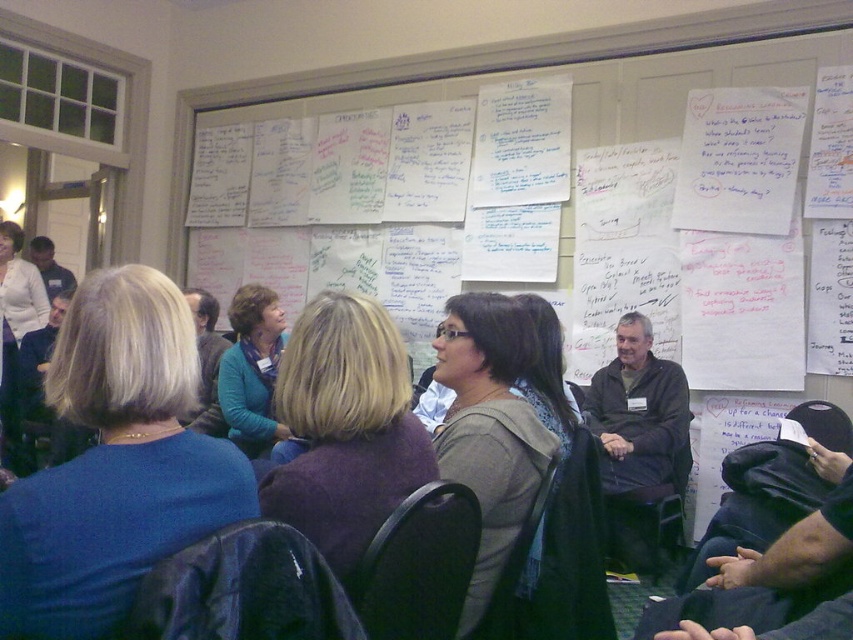
Question: Can you confirm if dark purple sweater at center is positioned above gray sweater at center?

Choices:
 (A) yes
 (B) no

Answer: (A)

Question: Which object is the farthest from the gray sweater at center?

Choices:
 (A) dark purple sweater at center
 (B) blue fabric at center

Answer: (B)

Question: Is blue fabric at center closer to the viewer compared to blue sweater at center?

Choices:
 (A) no
 (B) yes

Answer: (B)

Question: Does dark purple sweater at center come behind blue sweater at center?

Choices:
 (A) yes
 (B) no

Answer: (B)

Question: Which of the following is the closest to the observer?

Choices:
 (A) (247, 429)
 (B) (498, 330)

Answer: (B)

Question: Which object appears closest to the camera in this image?

Choices:
 (A) blue sweater at center
 (B) dark purple sweater at center
 (C) blue fabric at center
 (D) gray sweater at center

Answer: (C)